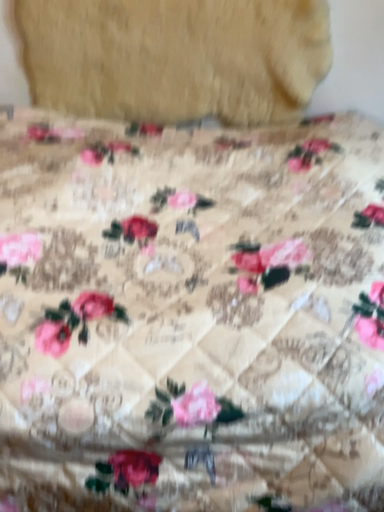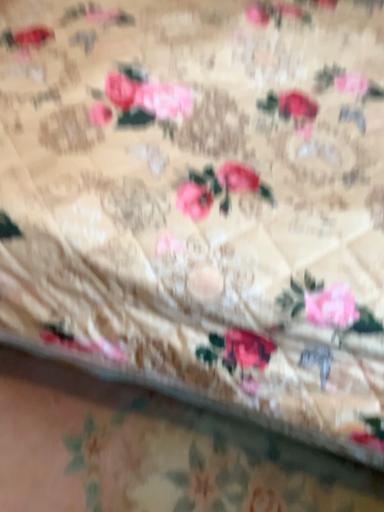
Question: Which way did the camera rotate in the video?

Choices:
 (A) rotated downward
 (B) rotated upward

Answer: (A)